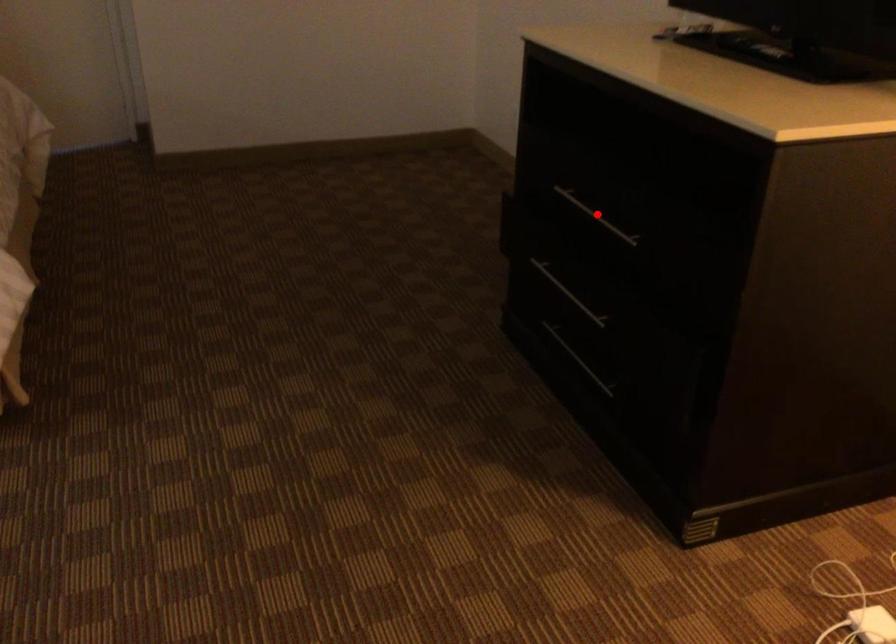
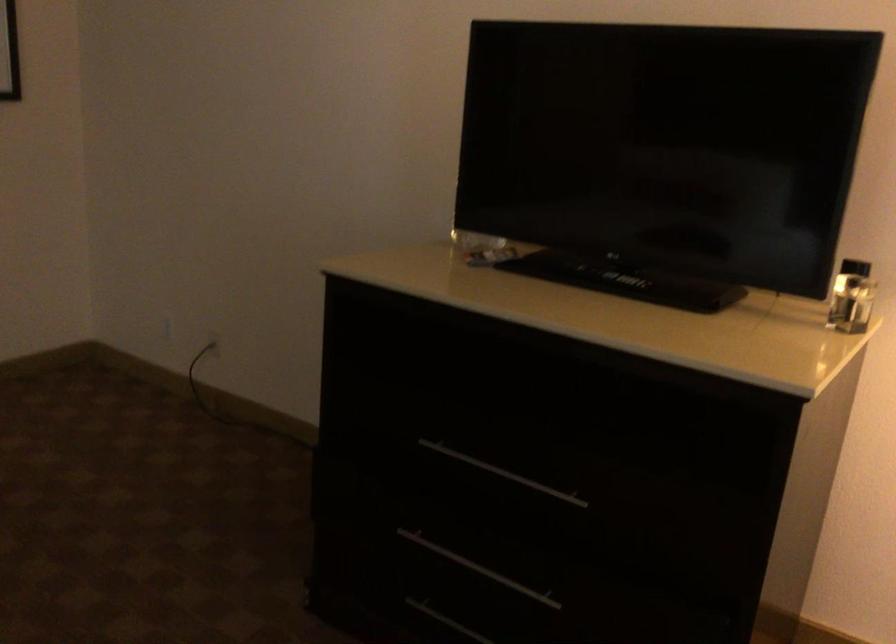
Where in the second image is the point corresponding to the highlighted location from the first image?

(502, 473)